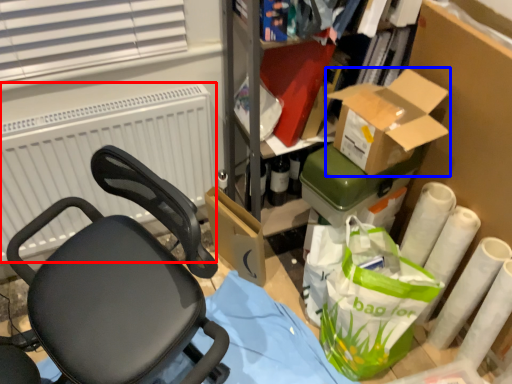
Question: Which object is further to the camera taking this photo, radiator (highlighted by a red box) or box (highlighted by a blue box)?

Choices:
 (A) radiator
 (B) box

Answer: (A)